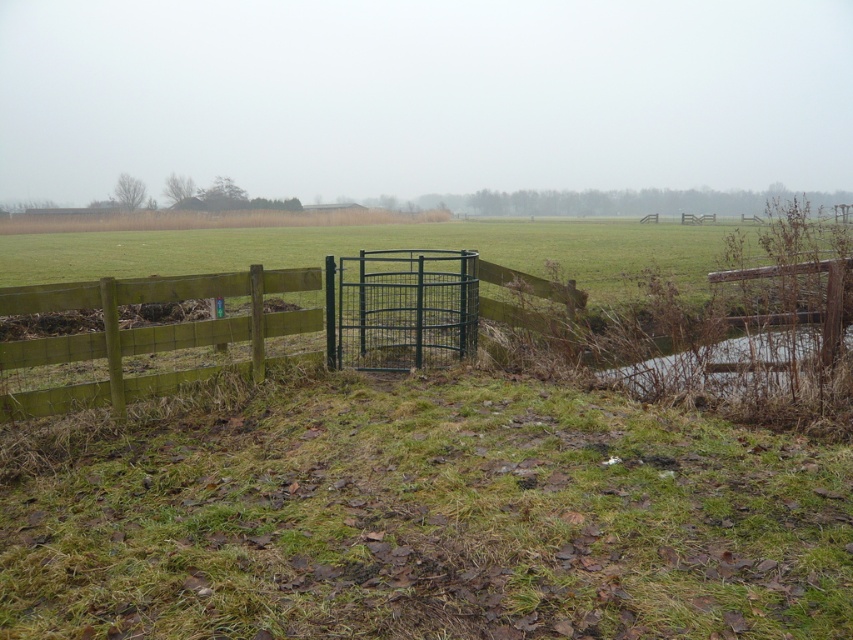
Is green wooden fence at left bigger than green wire cage at center?

No, green wooden fence at left is not bigger than green wire cage at center.

Is point (84, 392) closer to viewer compared to point (409, 353)?

Yes, it is in front of point (409, 353).

Where is `green wooden fence at left`? green wooden fence at left is located at coordinates (148, 333).